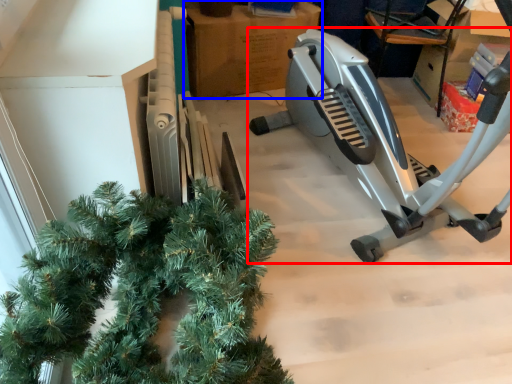
Question: Which object is further to the camera taking this photo, stationary bicycle (highlighted by a red box) or cardboard box (highlighted by a blue box)?

Choices:
 (A) stationary bicycle
 (B) cardboard box

Answer: (B)